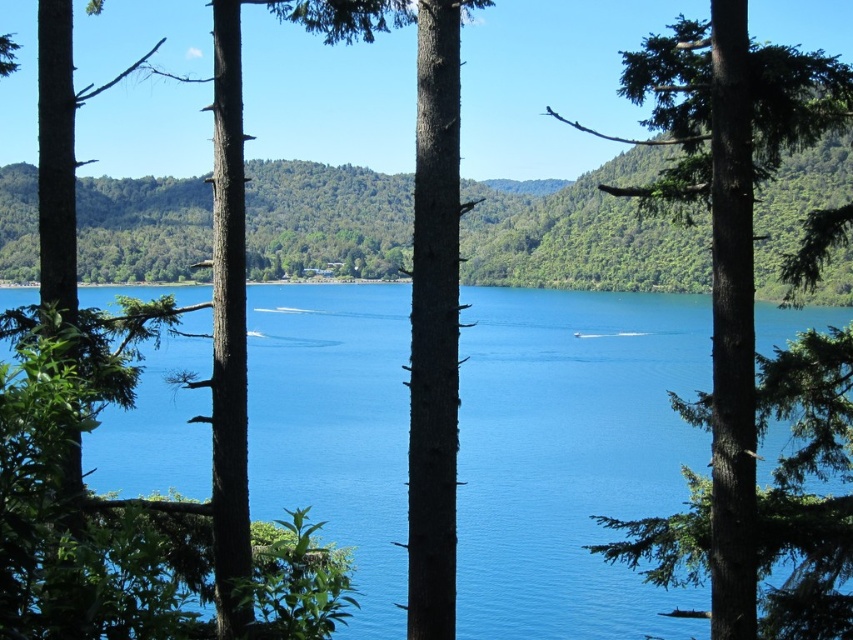
You are planning to take a photo of the blue water at center and the green textured tree at right. Which object should you focus on first if you want to capture both in a single frame without moving the camera?

The blue water at center has a larger size compared to the green textured tree at right, so you should focus on the blue water at center first to ensure it fills the frame appropriately before adjusting for the smaller tree.

You are standing at the edge of the lake and want to determine which object is taller between the blue water at center and the green textured tree at right. Based on the scene, which one is taller?

The green textured tree at right is taller than the blue water at center.

Looking at this image, you are a photographer planning to capture the entire scene of the blue water at center and the green textured tree at right in one frame. Based on their widths, which object should you position closer to the edge of the frame to ensure both fit?

Since the blue water at center is wider than the green textured tree at right, you should position the green textured tree at right closer to the edge of the frame to ensure both fit in the photograph.